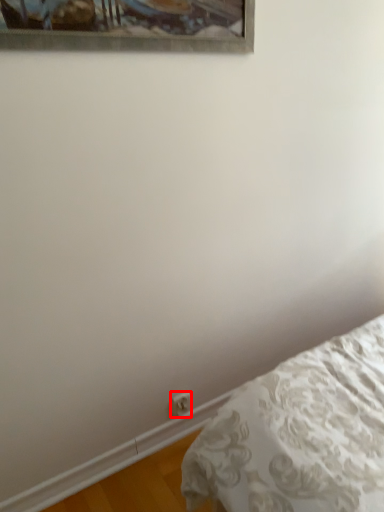
Question: Considering the relative positions of electric outlet (annotated by the red box) and bed in the image provided, where is electric outlet (annotated by the red box) located with respect to the staircase?

Choices:
 (A) left
 (B) right

Answer: (A)